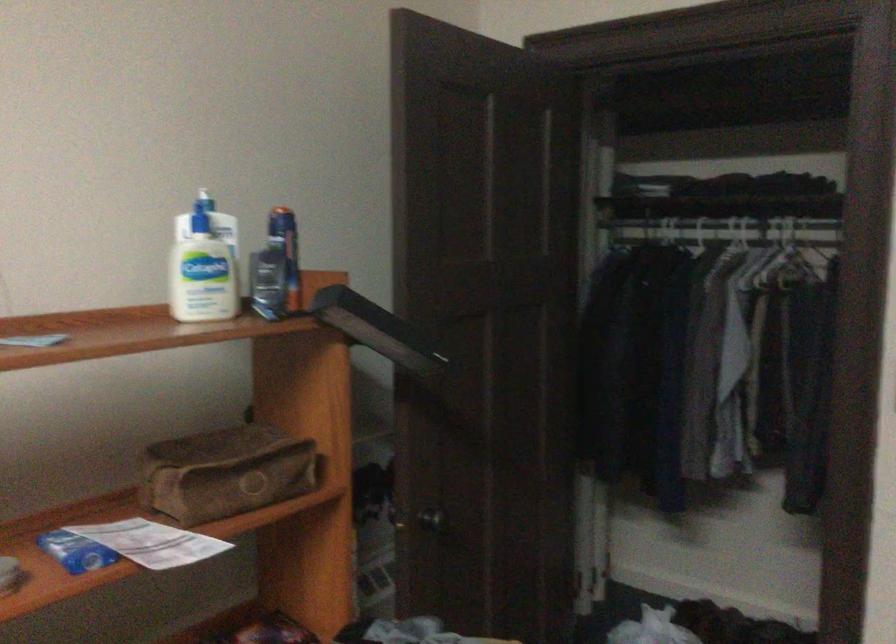
This screenshot has height=644, width=896. I want to click on silver doorknob, so point(433,520).